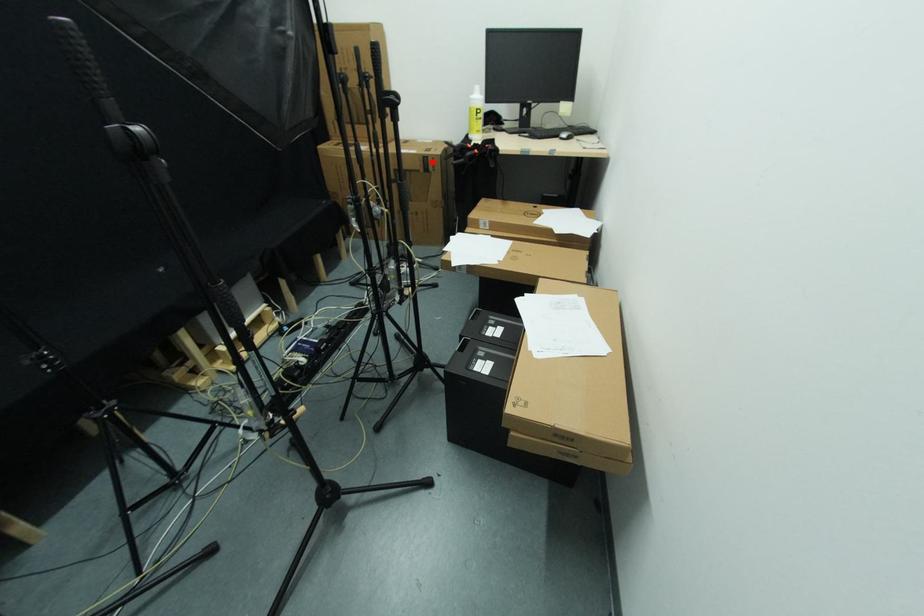
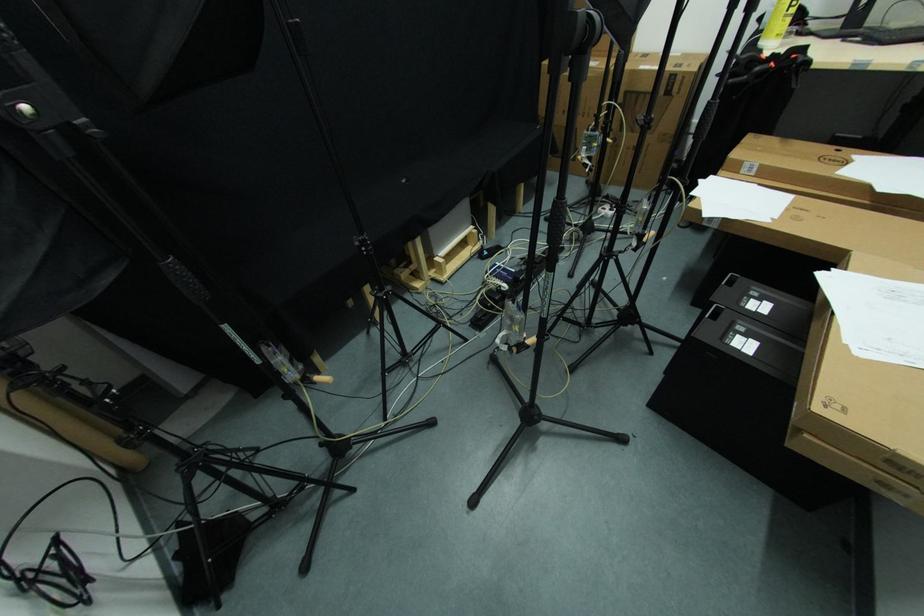
Question: I am providing you with two images of the same scene from different viewpoints. Image1 has a red point marked. In image2, the corresponding 3D location appears at what relative position? Reply with the corresponding letter.

Choices:
 (A) Closer
 (B) Farther

Answer: (B)